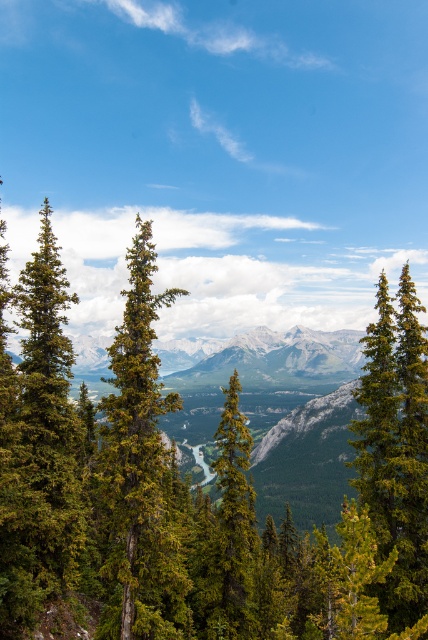
You are standing at the center of the image and want to locate the green matte evergreen tree at left. In which cardinal direction should you look to find it?

The green matte evergreen tree at left is positioned at coordinate point 0.700 on the x and 0.091 on the y axis, so you should look to the left side of the image to find it.

You are a hiker standing at the edge of the forest. You notice two trees in the scene described. Which tree has a wider base? The green matte tree at right or the green textured tree at center?

The green matte tree at right has a wider base than the green textured tree at center because its width surpasses the latter.

You are a hiker who wants to cross the river using a bridge that is 40 feet long. You see the green matte evergreen tree at left and the green textured tree at center. Which tree should you stand near to start building the bridge so that it reaches the other side of the river?

The green matte evergreen tree at left is 40.55 feet from the green textured tree at center. Since the bridge is 40 feet long, you should start building the bridge near the green textured tree at center to ensure it reaches the other side.